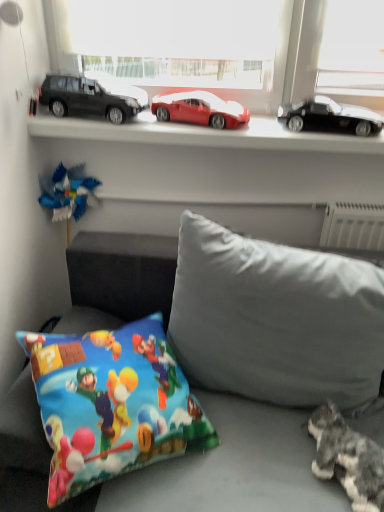
The height and width of the screenshot is (512, 384). Identify the location of glossy black car at upper right, which is counted as the third car, starting from the left. (331, 116).

Where is `shiny red car at center, which is counted as the 2th car, starting from the right`? shiny red car at center, which is counted as the 2th car, starting from the right is located at coordinates (199, 109).

What is the approximate width of printed fabric pillow at lower left, which appears as the 1th pillow when viewed from the left?

18.29 inches.

In order to click on matte black car at left, the third car in the right-to-left sequence in this screenshot , I will do `click(92, 96)`.

Find the location of a particular element. The image size is (384, 512). soft gray fabric couch at lower center is located at coordinates (235, 464).

What is the approximate height of soft gray fabric couch at lower center?

It is 29.28 inches.

This screenshot has height=512, width=384. What do you see at coordinates (275, 319) in the screenshot? I see `gray fabric pillow at center, arranged as the 1th pillow when viewed from the right` at bounding box center [275, 319].

Find the location of `gray fluffy cat at lower right`. gray fluffy cat at lower right is located at coordinates (348, 458).

Is gray fluffy cat at lower right not within metallic cars at upper center?

Yes.

Would you say gray fluffy cat at lower right is a long distance from metallic cars at upper center?

They are positioned close to each other.

From a real-world perspective, relative to metallic cars at upper center, is gray fluffy cat at lower right vertically above or below?

From a real-world perspective, gray fluffy cat at lower right is physically below metallic cars at upper center.

Considering the relative sizes of gray fluffy cat at lower right and metallic cars at upper center in the image provided, is gray fluffy cat at lower right smaller than metallic cars at upper center?

Yes.

Is metallic cars at upper center facing away from soft gray fabric couch at lower center?

No, metallic cars at upper center is not facing the opposite direction of soft gray fabric couch at lower center.

Does metallic cars at upper center have a lesser height compared to soft gray fabric couch at lower center?

Yes, metallic cars at upper center is shorter than soft gray fabric couch at lower center.

Which of these two, metallic cars at upper center or soft gray fabric couch at lower center, is thinner?

With smaller width is metallic cars at upper center.

Locate an element on the screen. The width and height of the screenshot is (384, 512). studio couch on the right of the metallic cars at upper center is located at coordinates (235, 464).

Measure the distance from gray fluffy cat at lower right to soft gray fabric couch at lower center.

gray fluffy cat at lower right is 12.31 inches away from soft gray fabric couch at lower center.

From the picture: Are gray fluffy cat at lower right and soft gray fabric couch at lower center beside each other?

They are not placed beside each other.

Does gray fluffy cat at lower right turn towards soft gray fabric couch at lower center?

Yes, gray fluffy cat at lower right is aimed at soft gray fabric couch at lower center.

Do you think gray fluffy cat at lower right is within soft gray fabric couch at lower center, or outside of it?

gray fluffy cat at lower right is enclosed within soft gray fabric couch at lower center.

How different are the orientations of glossy black car at upper right, the first car positioned from the right, and soft gray fabric couch at lower center in degrees?

glossy black car at upper right, the first car positioned from the right, and soft gray fabric couch at lower center are facing 9.35 degrees away from each other.

Which is more to the left, glossy black car at upper right, which is counted as the third car, starting from the left, or soft gray fabric couch at lower center?

Positioned to the left is soft gray fabric couch at lower center.

Which is behind, glossy black car at upper right, which is counted as the third car, starting from the left, or soft gray fabric couch at lower center?

glossy black car at upper right, which is counted as the third car, starting from the left, is further from the camera.

In the scene shown: Is soft gray fabric couch at lower center located within glossy black car at upper right, the first car positioned from the right?

No, glossy black car at upper right, the first car positioned from the right, does not contain soft gray fabric couch at lower center.

Considering the positions of objects gray fabric pillow at center, arranged as the 1th pillow when viewed from the right, and glossy black car at upper right, the first car positioned from the right, in the image provided, who is in front, gray fabric pillow at center, arranged as the 1th pillow when viewed from the right, or glossy black car at upper right, the first car positioned from the right,?

gray fabric pillow at center, arranged as the 1th pillow when viewed from the right, is closer to the camera.

Is point (210, 231) less distant than point (338, 109)?

Yes, it is.

How distant is gray fabric pillow at center, marked as the second pillow in a left-to-right arrangement, from glossy black car at upper right, the first car positioned from the right?

gray fabric pillow at center, marked as the second pillow in a left-to-right arrangement, is 23.28 inches from glossy black car at upper right, the first car positioned from the right.

Could you tell me if gray fabric pillow at center, arranged as the 1th pillow when viewed from the right, is turned towards glossy black car at upper right, the first car positioned from the right?

No, gray fabric pillow at center, arranged as the 1th pillow when viewed from the right, does not turn towards glossy black car at upper right, the first car positioned from the right.

How much distance is there between metallic cars at upper center and gray fluffy cat at lower right?

A distance of 34.35 inches exists between metallic cars at upper center and gray fluffy cat at lower right.

Is metallic cars at upper center bigger or smaller than gray fluffy cat at lower right?

Considering their sizes, metallic cars at upper center takes up more space than gray fluffy cat at lower right.

From the image's perspective, is metallic cars at upper center above gray fluffy cat at lower right?

Indeed, from the image's perspective, metallic cars at upper center is shown above gray fluffy cat at lower right.

Between metallic cars at upper center and gray fluffy cat at lower right, which one has more height?

Standing taller between the two is gray fluffy cat at lower right.

In the scene shown: Does shiny red car at center, which is counted as the 2th car, starting from the right, have a greater height compared to printed fabric pillow at lower left, which is the second pillow in right-to-left order?

No, shiny red car at center, which is counted as the 2th car, starting from the right, is not taller than printed fabric pillow at lower left, which is the second pillow in right-to-left order.

Is shiny red car at center, which is counted as the 2th car, starting from the right, far away from printed fabric pillow at lower left, which is the second pillow in right-to-left order?

They are positioned close to each other.

Considering the relative sizes of shiny red car at center, which is counted as the 2th car, starting from the right, and printed fabric pillow at lower left, which is the second pillow in right-to-left order, in the image provided, is shiny red car at center, which is counted as the 2th car, starting from the right, bigger than printed fabric pillow at lower left, which is the second pillow in right-to-left order,?

Incorrect, shiny red car at center, which is counted as the 2th car, starting from the right, is not larger than printed fabric pillow at lower left, which is the second pillow in right-to-left order.

Image resolution: width=384 pixels, height=512 pixels. In order to click on window sill behind the gray fluffy cat at lower right in this screenshot , I will do `click(204, 134)`.

Identify the location of studio couch located in front of the metallic cars at upper center. (235, 464).

Based on their spatial positions, is gray fluffy cat at lower right or soft gray fabric couch at lower center further from printed fabric pillow at lower left, which appears as the 1th pillow when viewed from the left?

gray fluffy cat at lower right.

Considering their positions, is soft gray fabric couch at lower center positioned further to glossy black car at upper right, the first car positioned from the right, than matte black car at left, the third car in the right-to-left sequence?

Among the two, soft gray fabric couch at lower center is located further to glossy black car at upper right, the first car positioned from the right.

Estimate the real-world distances between objects in this image. Which object is closer to metallic cars at upper center, soft gray fabric couch at lower center or glossy black car at upper right, the first car positioned from the right?

Based on the image, glossy black car at upper right, the first car positioned from the right, appears to be nearer to metallic cars at upper center.

Considering their positions, is soft gray fabric couch at lower center positioned closer to gray fabric pillow at center, arranged as the 1th pillow when viewed from the right, than shiny red car at center, which is counted as the 2th car, starting from the right?

Among the two, soft gray fabric couch at lower center is located nearer to gray fabric pillow at center, arranged as the 1th pillow when viewed from the right.

Which object lies further to the anchor point metallic cars at upper center, soft gray fabric couch at lower center or gray fluffy cat at lower right?

gray fluffy cat at lower right is further to metallic cars at upper center.

Estimate the real-world distances between objects in this image. Which object is closer to gray fabric pillow at center, arranged as the 1th pillow when viewed from the right, printed fabric pillow at lower left, which is the second pillow in right-to-left order, or matte black car at left, the third car in the right-to-left sequence?

printed fabric pillow at lower left, which is the second pillow in right-to-left order, is positioned closer to the anchor gray fabric pillow at center, arranged as the 1th pillow when viewed from the right.

Looking at this image, based on their spatial positions, is soft gray fabric couch at lower center or shiny red car at center, which is counted as the 2th car, starting from the right, further from metallic cars at upper center?

Among the two, soft gray fabric couch at lower center is located further to metallic cars at upper center.

Consider the image. Looking at the image, which one is located closer to glossy black car at upper right, the first car positioned from the right, matte black car at left, the third car in the right-to-left sequence, or printed fabric pillow at lower left, which appears as the 1th pillow when viewed from the left?

The object closer to glossy black car at upper right, the first car positioned from the right, is matte black car at left, the third car in the right-to-left sequence.

Locate an element on the screen. window sill between matte black car at left, the third car in the right-to-left sequence, and gray fabric pillow at center, arranged as the 1th pillow when viewed from the right, in the up-down direction is located at coordinates (204, 134).

Image resolution: width=384 pixels, height=512 pixels. Identify the location of pillow between matte black car at left, the third car in the right-to-left sequence, and printed fabric pillow at lower left, which appears as the 1th pillow when viewed from the left, in the up-down direction. (275, 319).

The image size is (384, 512). In order to click on studio couch situated between printed fabric pillow at lower left, which appears as the 1th pillow when viewed from the left, and gray fluffy cat at lower right from left to right in this screenshot , I will do pos(235,464).

Identify the location of window sill between shiny red car at center, which is counted as the 2th car, starting from the right, and printed fabric pillow at lower left, which is the second pillow in right-to-left order, vertically. The width and height of the screenshot is (384, 512). (204, 134).